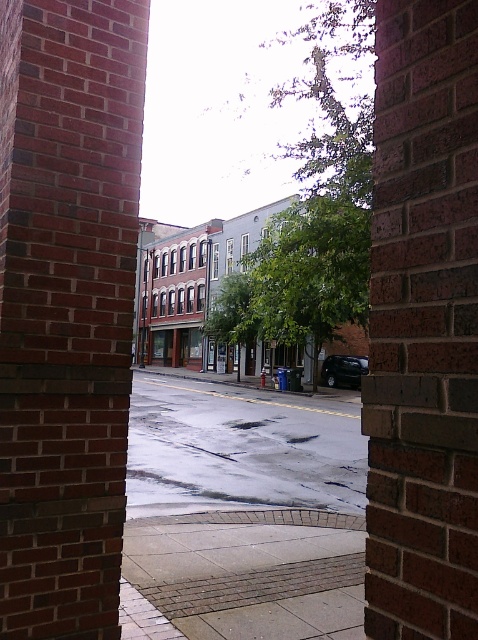
You are a delivery person trying to avoid puddles while walking down the street. You see the smooth concrete pavement at center and the wet asphalt at center. Which surface should you walk on to stay dry?

The smooth concrete pavement at center is positioned on the right side of wet asphalt at center. Since the asphalt is wet, you should walk on the smooth concrete pavement at center to avoid getting wet.

You are standing at the entrance of the street framed by brick pillars and looking down the wet street. You notice the wet asphalt at center and the shiny black car at center. Which object appears taller in the scene?

The wet asphalt at center appears taller than the shiny black car at center in the scene.